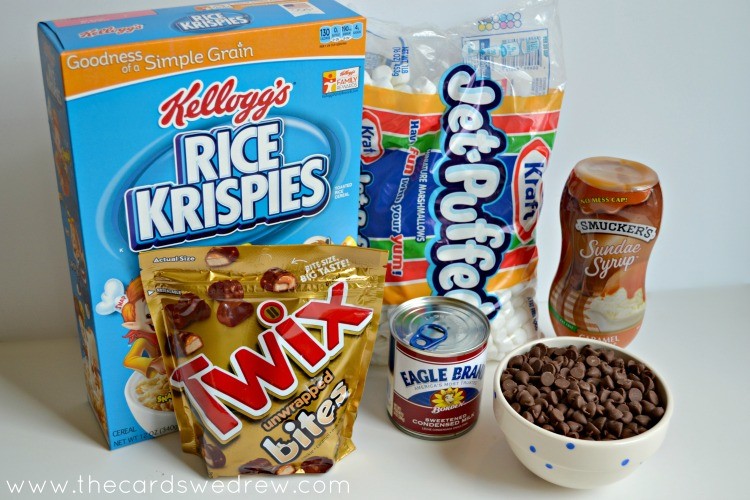
This screenshot has height=500, width=750. I want to click on bowl, so click(628, 462).